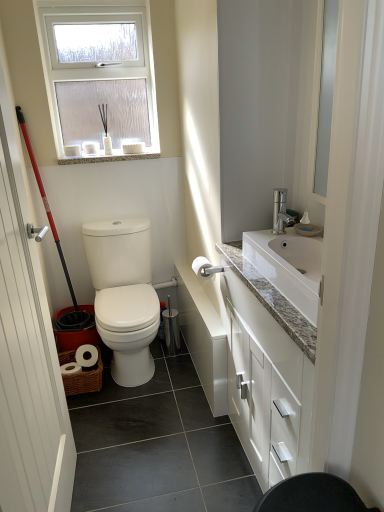
The width and height of the screenshot is (384, 512). Find the location of `free space on the front side of white glossy toilet at center-left`. free space on the front side of white glossy toilet at center-left is located at coordinates (132, 393).